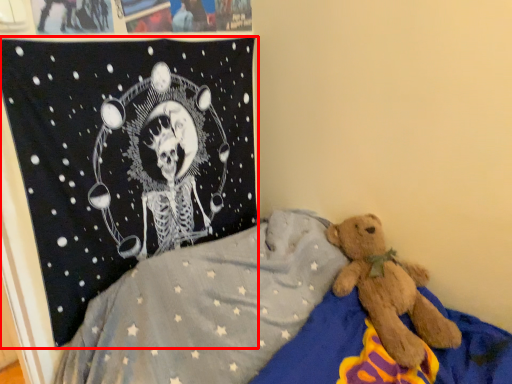
Question: From the image's perspective, considering the relative positions of pirate flag (annotated by the red box) and bed in the image provided, where is pirate flag (annotated by the red box) located with respect to the staircase?

Choices:
 (A) below
 (B) above

Answer: (B)